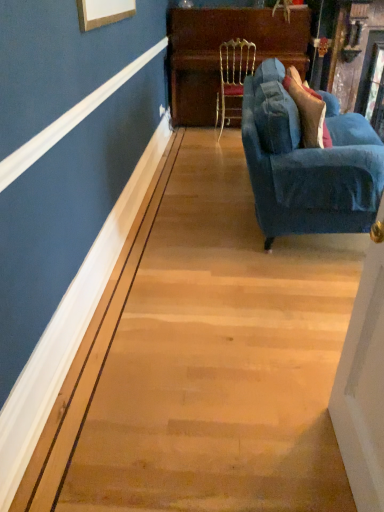
Question: Considering the relative positions of gold textured chair at center and wooden polished dresser at upper center in the image provided, is gold textured chair at center to the left of wooden polished dresser at upper center from the viewer's perspective?

Choices:
 (A) yes
 (B) no

Answer: (A)

Question: Is gold textured chair at center in front of wooden polished dresser at upper center?

Choices:
 (A) no
 (B) yes

Answer: (B)

Question: Is gold textured chair at center facing away from wooden polished dresser at upper center?

Choices:
 (A) yes
 (B) no

Answer: (A)

Question: Is gold textured chair at center completely or partially outside of wooden polished dresser at upper center?

Choices:
 (A) no
 (B) yes

Answer: (A)

Question: From a real-world perspective, is gold textured chair at center positioned under wooden polished dresser at upper center based on gravity?

Choices:
 (A) no
 (B) yes

Answer: (B)

Question: Is velvet blue couch at right in front of or behind gold textured chair at center in the image?

Choices:
 (A) behind
 (B) front

Answer: (B)

Question: From a real-world perspective, relative to gold textured chair at center, is velvet blue couch at right vertically above or below?

Choices:
 (A) below
 (B) above

Answer: (A)

Question: Based on their sizes in the image, would you say velvet blue couch at right is bigger or smaller than gold textured chair at center?

Choices:
 (A) small
 (B) big

Answer: (B)

Question: Is velvet blue couch at right taller or shorter than gold textured chair at center?

Choices:
 (A) tall
 (B) short

Answer: (B)

Question: From a real-world perspective, is wooden polished dresser at upper center positioned above or below velvet blue couch at right?

Choices:
 (A) below
 (B) above

Answer: (B)

Question: Would you say wooden polished dresser at upper center is to the left or to the right of velvet blue couch at right in the picture?

Choices:
 (A) right
 (B) left

Answer: (B)

Question: From the image's perspective, is wooden polished dresser at upper center positioned above or below velvet blue couch at right?

Choices:
 (A) below
 (B) above

Answer: (B)

Question: Relative to velvet blue couch at right, is wooden polished dresser at upper center in front or behind?

Choices:
 (A) front
 (B) behind

Answer: (B)

Question: In terms of height, does gold textured chair at center look taller or shorter compared to wooden polished dresser at upper center?

Choices:
 (A) tall
 (B) short

Answer: (B)

Question: From the image's perspective, is gold textured chair at center located above or below wooden polished dresser at upper center?

Choices:
 (A) below
 (B) above

Answer: (A)